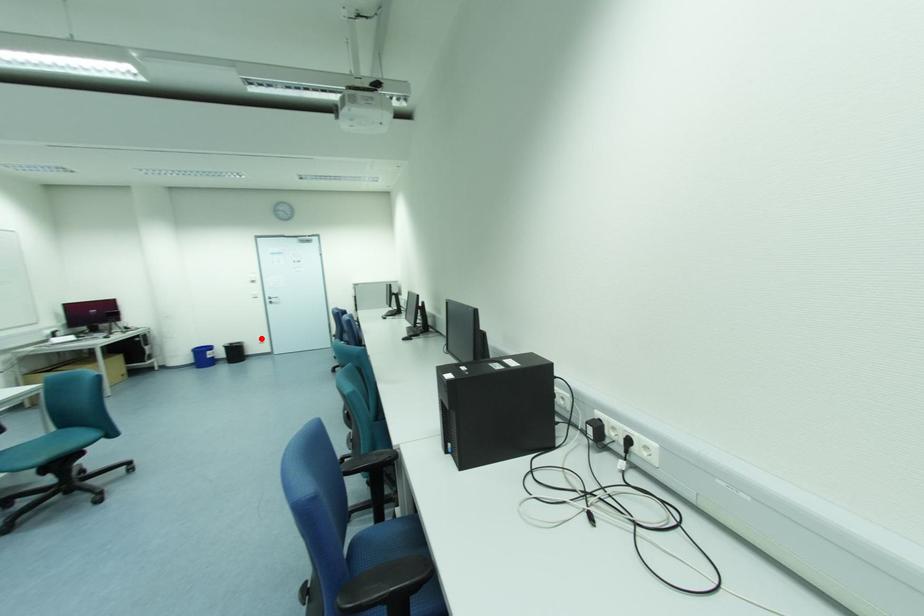
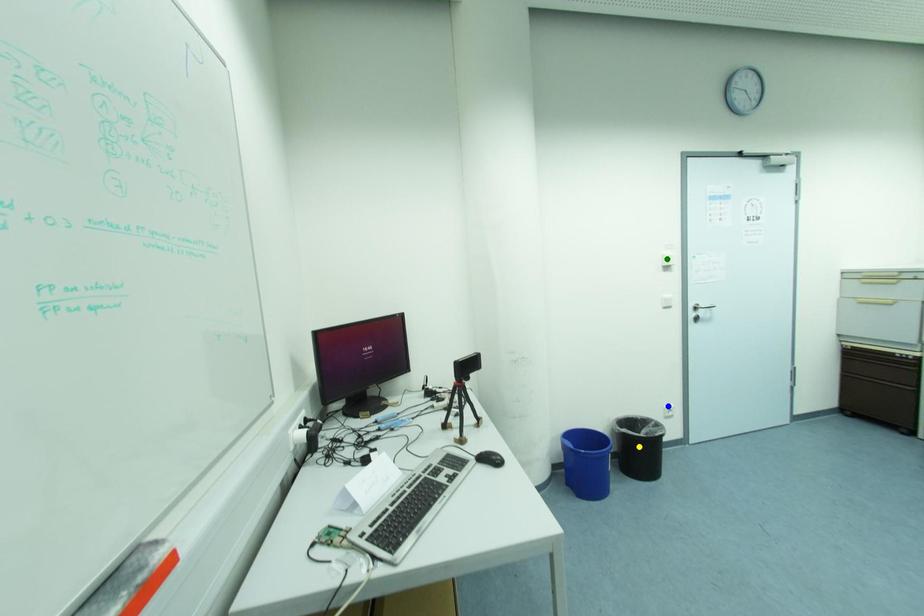
Question: I am providing you with two images of the same scene from different viewpoints. A red point is marked on the first image. You are given multiple points on the second image. Which spot in image 2 lines up with the point in image 1?

Choices:
 (A) yellow point
 (B) green point
 (C) blue point

Answer: (C)